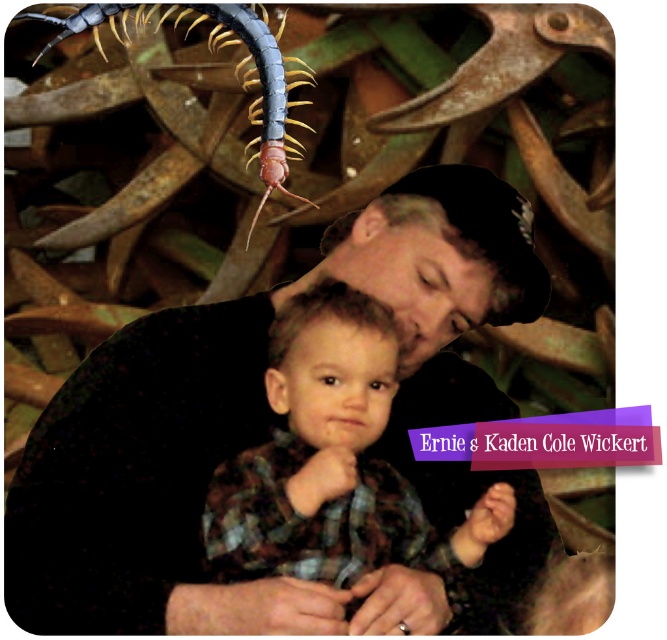
In the scene, you notice the black matte shirt at center and the gray matte centipede at upper left. Which object is located to the right of the other?

The black matte shirt at center is positioned on the right side of gray matte centipede at upper left.

You are a photographer trying to focus on the black matte shirt at center and the gray matte centipede at upper left. Which object is positioned closer to your camera lens?

The black matte shirt at center is closer to the viewer than the gray matte centipede at upper left, so the black matte shirt at center will be in focus first when adjusting the camera lens.

You are standing in the scene and want to place a small decoration between the two points, point (536, 534) and point (235, 572). Which point should the decoration be closer to so it doesn,t block the view of the centipede?

The decoration should be closer to point (235, 572) because point (536, 534) is behind point (235, 572), so placing it near the front point would avoid blocking the view of the centipede.